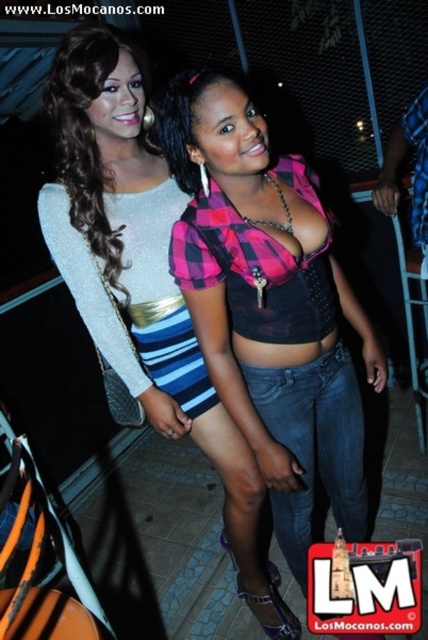
Question: In this image, where is pink plaid shirt at center located relative to matte black dress at center?

Choices:
 (A) right
 (B) left

Answer: (A)

Question: Can you confirm if pink plaid shirt at center is positioned to the left of shiny silver purse at upper left?

Choices:
 (A) no
 (B) yes

Answer: (A)

Question: Based on their relative distances, which object is farther from the matte black dress at center?

Choices:
 (A) pink plaid shirt at center
 (B) shiny silver purse at upper left

Answer: (B)

Question: Can you confirm if matte black dress at center is positioned to the right of shiny silver purse at upper left?

Choices:
 (A) yes
 (B) no

Answer: (A)

Question: Among these points, which one is nearest to the camera?

Choices:
 (A) (56, 138)
 (B) (207, 76)
 (C) (252, 461)

Answer: (B)

Question: Which of these objects is positioned closest to the shiny silver purse at upper left?

Choices:
 (A) pink plaid shirt at center
 (B) matte black dress at center

Answer: (B)